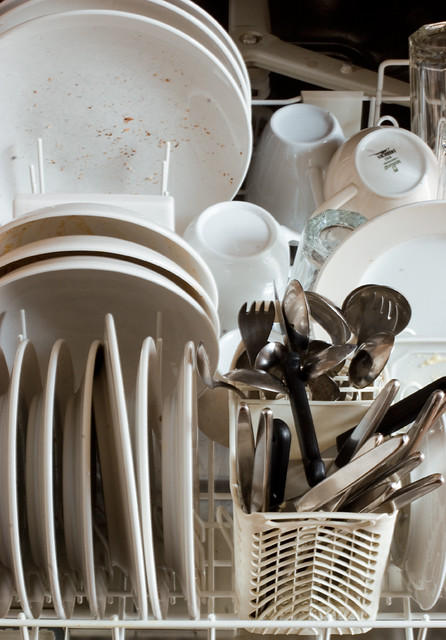
Where is `cup bottoms`? The image size is (446, 640). cup bottoms is located at coordinates (440, 36), (398, 161), (301, 127), (336, 232), (245, 230), (231, 354).